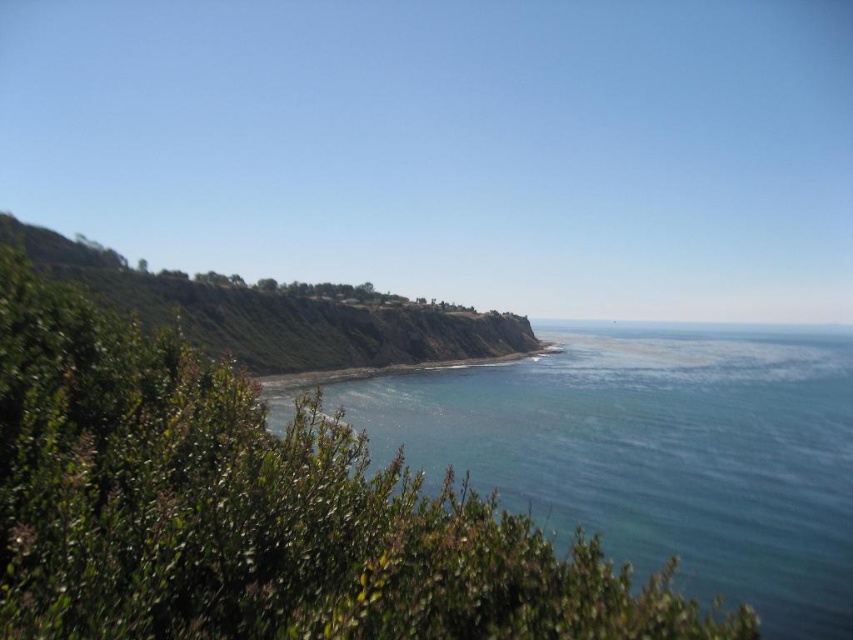
Who is positioned more to the right, green leafy shrubs at center or green grassy shoreline at center?

From the viewer's perspective, green grassy shoreline at center appears more on the right side.

Identify the location of green leafy shrubs at center. (254, 509).

You are a GUI agent. You are given a task and a screenshot of the screen. Output one action in this format:
    pyautogui.click(x=<x>, y=<y>)
    Task: Click on the green leafy shrubs at center
    This screenshot has width=853, height=640.
    Given the screenshot: What is the action you would take?
    254,509

Does blue smooth water at center appear over green grassy hillside at left?

No, blue smooth water at center is not above green grassy hillside at left.

Is blue smooth water at center taller than green grassy hillside at left?

Incorrect, blue smooth water at center's height is not larger of green grassy hillside at left's.

Who is more forward, (648, 524) or (265, 308)?

Point (648, 524)

Identify the location of blue smooth water at center. This screenshot has height=640, width=853. (650, 451).

Who is shorter, green leafy shrubs at center or blue smooth water at center?

blue smooth water at center is shorter.

Can you confirm if green leafy shrubs at center is positioned to the right of blue smooth water at center?

No, green leafy shrubs at center is not to the right of blue smooth water at center.

Is point (247, 384) closer to camera compared to point (450, 444)?

That is True.

Locate an element on the screen. green leafy shrubs at center is located at coordinates (254, 509).